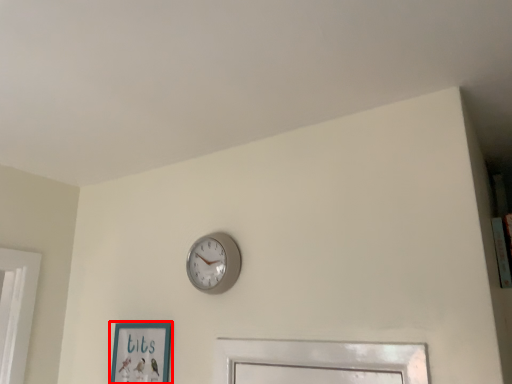
Question: From the image's perspective, where is picture frame (annotated by the red box) located relative to wall clock?

Choices:
 (A) above
 (B) below

Answer: (B)